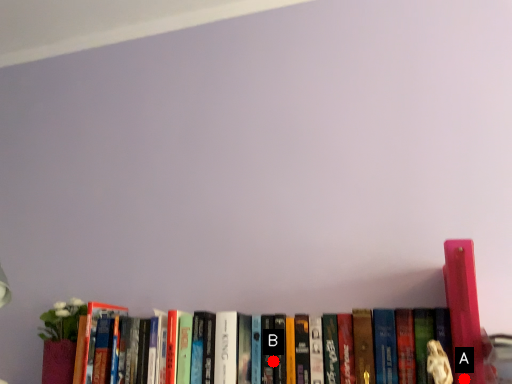
Question: Two points are circled on the image, labeled by A and B beside each circle. Among these points, which one is nearest to the camera?

Choices:
 (A) A is closer
 (B) B is closer

Answer: (A)